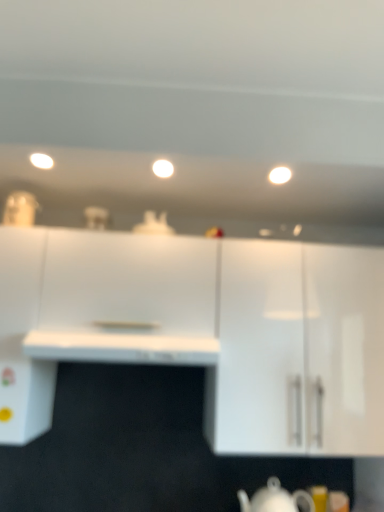
Find the location of `free space in front of white glossy light fixture at center, which appears as the 2th lighting when viewed from the right`. free space in front of white glossy light fixture at center, which appears as the 2th lighting when viewed from the right is located at coordinates pyautogui.click(x=167, y=159).